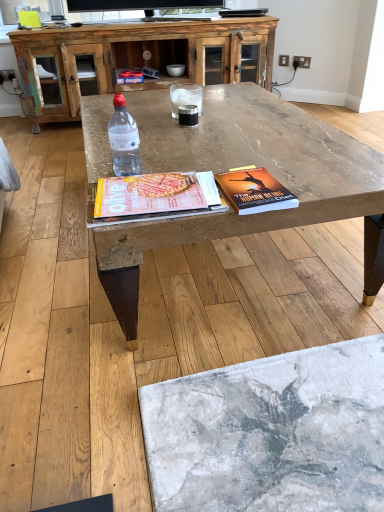
I want to click on vacant area that lies between matte paper magazine at center and transparent plastic bottle at center, so click(156, 172).